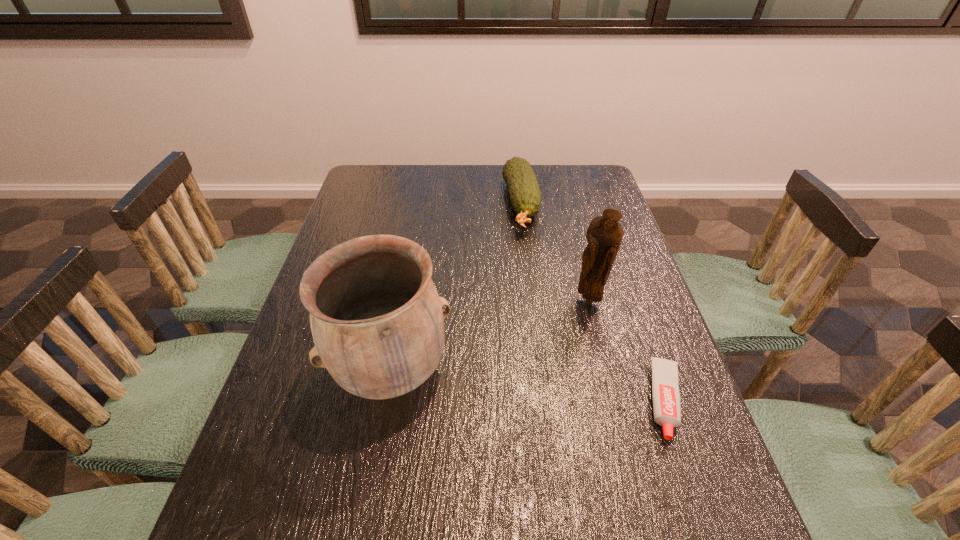
The width and height of the screenshot is (960, 540). In order to click on unoccupied position between the second farthest object and the rightmost object in this screenshot , I will do `click(628, 351)`.

This screenshot has height=540, width=960. I want to click on vacant point located between the urn and the second farthest object, so click(x=491, y=336).

Find the location of a particular element. vacant space in between the shortest object and the third tallest object is located at coordinates (593, 302).

Select which object is the second closest to the leftmost object. Please provide its 2D coordinates. Your answer should be formatted as a tuple, i.e. [(x, y)], where the tuple contains the x and y coordinates of a point satisfying the conditions above.

[(525, 195)]

The image size is (960, 540). I want to click on object that stands as the closest to the leftmost object, so click(x=604, y=235).

Where is `vacant area that satisfies the following two spatial constraints: 1. on the front side of the cucumber; 2. on the right side of the toothpaste`? This screenshot has height=540, width=960. vacant area that satisfies the following two spatial constraints: 1. on the front side of the cucumber; 2. on the right side of the toothpaste is located at coordinates (544, 400).